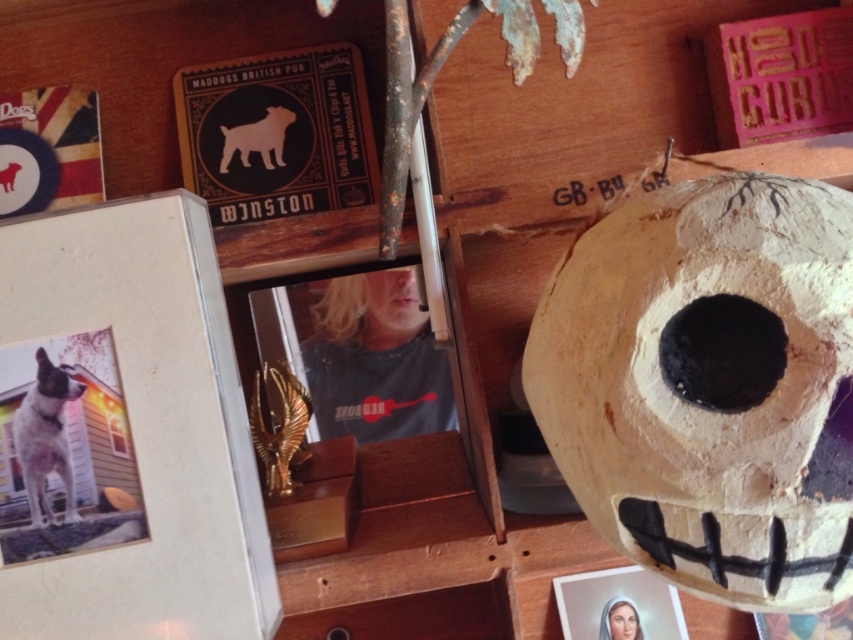
Question: Is gray fabric shirt at center above matte black dog at upper left?

Choices:
 (A) yes
 (B) no

Answer: (B)

Question: Which point is closer to the camera?

Choices:
 (A) matte black dog at upper left
 (B) matte papier-mâché skull at right

Answer: (B)

Question: Observing the image, what is the correct spatial positioning of matte papier-mâché skull at right in reference to white fur dog at left?

Choices:
 (A) left
 (B) right

Answer: (B)

Question: Is gray fabric shirt at center positioned behind matte black dog at upper left?

Choices:
 (A) yes
 (B) no

Answer: (A)

Question: Which point is closer to the camera?

Choices:
 (A) (779, 515)
 (B) (238, 140)
 (C) (610, 616)
 (D) (303, 426)

Answer: (A)

Question: Which object appears closest to the camera in this image?

Choices:
 (A) matte black dog at upper left
 (B) gold metallic eagle at center
 (C) gray fabric shirt at center

Answer: (B)